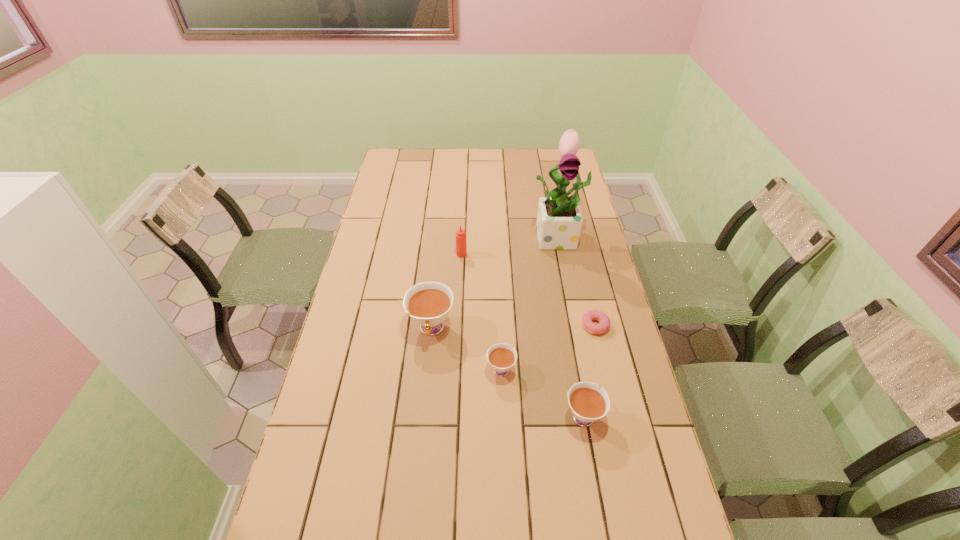
Please point a vacant point for placing a teacup on the left. Please provide its 2D coordinates. Your answer should be formatted as a tuple, i.e. [(x, y)], where the tuple contains the x and y coordinates of a point satisfying the conditions above.

[(372, 295)]